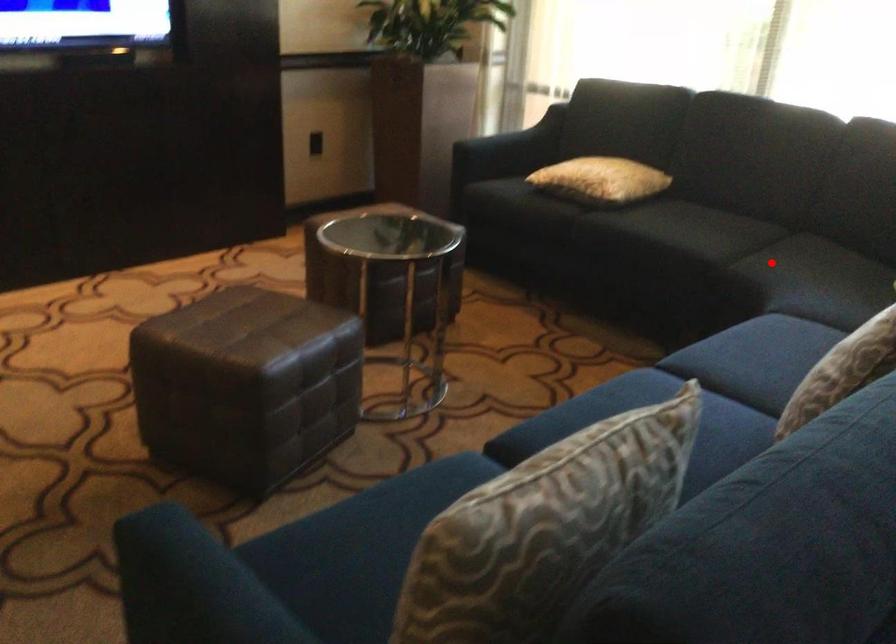
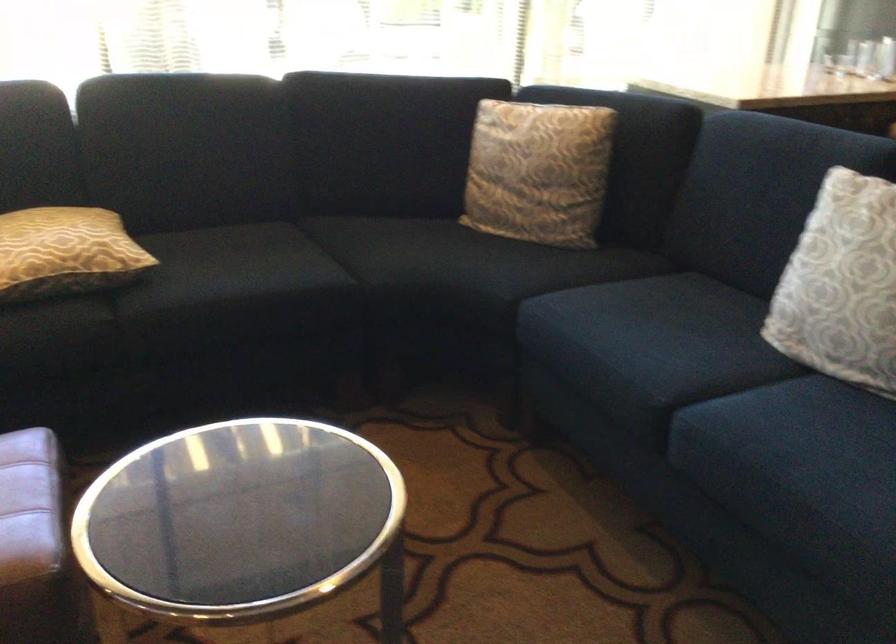
Question: I am providing you with two images of the same scene from different viewpoints. A red point is shown in image1. For the corresponding object point in image2, is it positioned nearer or farther from the camera?

Choices:
 (A) Nearer
 (B) Farther

Answer: (A)